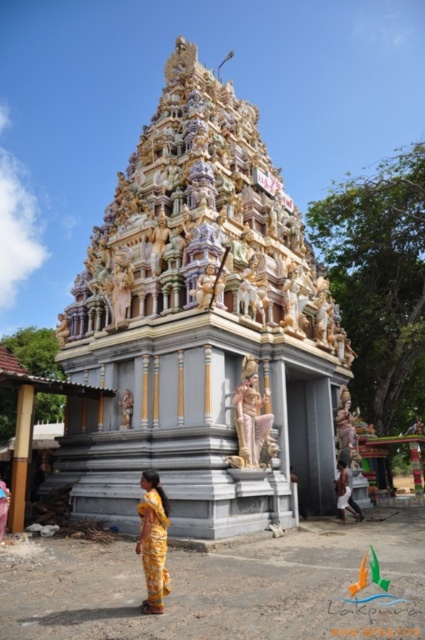
Question: Which point is closer to the camera taking this photo?

Choices:
 (A) (345, 467)
 (B) (147, 442)

Answer: (B)

Question: Which point appears closest to the camera in this image?

Choices:
 (A) (323, 282)
 (B) (340, 492)

Answer: (B)

Question: Can you confirm if polished stone temple at center is positioned below yellow printed sari at lower center?

Choices:
 (A) yes
 (B) no

Answer: (B)

Question: Can you confirm if yellow printed sari at lower center is positioned to the left of yellow fabric dress at lower center?

Choices:
 (A) yes
 (B) no

Answer: (A)

Question: Is polished stone temple at center wider than yellow printed sari at lower center?

Choices:
 (A) yes
 (B) no

Answer: (A)

Question: Estimate the real-world distances between objects in this image. Which object is closer to the yellow fabric dress at lower center?

Choices:
 (A) polished stone temple at center
 (B) yellow printed sari at lower center
 (C) gold textured statue at center

Answer: (C)